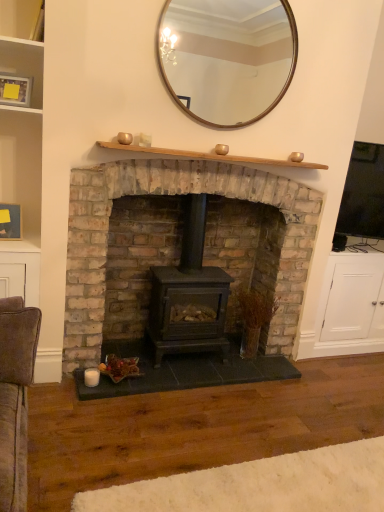
The height and width of the screenshot is (512, 384). Find the location of `matte black wood burning stove at center`. matte black wood burning stove at center is located at coordinates (189, 295).

In order to face wooden picture frame at left, the first picture frame viewed from the back, should I rotate leftwards or rightwards?

Turn left approximately 24.178 degrees to face it.

The height and width of the screenshot is (512, 384). Describe the element at coordinates (181, 242) in the screenshot. I see `matte black wood stove at center` at that location.

Measure the distance between point (25, 82) and camera.

The depth of point (25, 82) is 7.44 feet.

This screenshot has width=384, height=512. Describe the element at coordinates (15, 90) in the screenshot. I see `matte wooden picture frame at upper left, which is counted as the first picture frame, starting from the front` at that location.

Identify the location of wooden shelf at upper center. This screenshot has width=384, height=512. (209, 156).

Is point (250, 158) positioned before point (268, 475)?

No, it is not.

Choose the correct answer: Is wooden shelf at upper center inside white wool rug at lower center or outside it?

wooden shelf at upper center exists outside the volume of white wool rug at lower center.

Can you see wooden shelf at upper center touching white wool rug at lower center?

No, wooden shelf at upper center is not next to white wool rug at lower center.

From a real-world perspective, is matte black wood burning stove at center above or below white wool rug at lower center?

From a real-world perspective, matte black wood burning stove at center is physically above white wool rug at lower center.

Can you tell me how much matte black wood burning stove at center and white wool rug at lower center differ in facing direction?

0.79 degrees separate the facing orientations of matte black wood burning stove at center and white wool rug at lower center.

Is matte black wood burning stove at center inside the boundaries of white wool rug at lower center, or outside?

matte black wood burning stove at center is located beyond the bounds of white wool rug at lower center.

Would you say matte black wood burning stove at center is to the left or to the right of white wool rug at lower center in the picture?

matte black wood burning stove at center is positioned on white wool rug at lower center's left side.

From the image's perspective, which is above, wooden-framed mirror at upper center or white wool rug at lower center?

wooden-framed mirror at upper center.

Which of these two, wooden-framed mirror at upper center or white wool rug at lower center, stands taller?

Standing taller between the two is wooden-framed mirror at upper center.

From a real-world perspective, is wooden-framed mirror at upper center positioned over white wool rug at lower center based on gravity?

Yes.

Looking at this image, is wooden-framed mirror at upper center surrounded by matte black wood burning stove at center?

Definitely not — wooden-framed mirror at upper center is not inside matte black wood burning stove at center.

In the scene shown: Is matte black wood burning stove at center wider than wooden-framed mirror at upper center?

Yes.

Is point (196, 241) closer or farther from the camera than point (230, 109)?

Point (196, 241) is positioned farther from the camera compared to point (230, 109).

Does point (283, 237) lie behind point (267, 493)?

Yes, it is behind point (267, 493).

From the image's perspective, would you say matte black wood stove at center is shown under white wool rug at lower center?

No.

Is matte black wood stove at center positioned with its back to white wool rug at lower center?

matte black wood stove at center does not have its back to white wool rug at lower center.

Between white wool rug at lower center and matte black wood burning stove at center, which one has less height?

Standing shorter between the two is white wool rug at lower center.

Consider the image. Is matte black wood burning stove at center located within white wool rug at lower center?

Definitely not — matte black wood burning stove at center is not inside white wool rug at lower center.

Can you confirm if white wool rug at lower center is positioned to the left of matte black wood burning stove at center?

No.

Measure the distance from white wool rug at lower center to matte black wood burning stove at center.

A distance of 3.68 feet exists between white wool rug at lower center and matte black wood burning stove at center.

Does wooden-framed mirror at upper center turn towards matte black wood stove at center?

No, wooden-framed mirror at upper center is not aimed at matte black wood stove at center.

Considering the points (233, 50) and (214, 233), which point is behind, point (233, 50) or point (214, 233)?

Positioned behind is point (214, 233).

Find the location of a particular element. This screenshot has height=512, width=384. mirror that is behind the matte black wood stove at center is located at coordinates (227, 57).

Where is `mantle on the left of white wool rug at lower center`? This screenshot has width=384, height=512. mantle on the left of white wool rug at lower center is located at coordinates (209, 156).

The height and width of the screenshot is (512, 384). What are the coordinates of `plain that appears in front of the matte black wood burning stove at center` in the screenshot? It's located at (x=260, y=485).

From the image, which object appears to be farther from wooden-framed mirror at upper center, matte black wood stove at center or wooden shelf at upper center?

matte black wood stove at center is positioned further to the anchor wooden-framed mirror at upper center.

Estimate the real-world distances between objects in this image. Which object is further from wooden picture frame at left, the first picture frame viewed from the back, matte black wood stove at center or matte wooden picture frame at upper left, which is the 1th picture frame in top-to-bottom order?

matte black wood stove at center is further to wooden picture frame at left, the first picture frame viewed from the back.

Based on their spatial positions, is wooden picture frame at left, arranged as the 2th picture frame when viewed from the top, or wooden shelf at upper center closer to matte wooden picture frame at upper left, which is counted as the first picture frame, starting from the front?

wooden picture frame at left, arranged as the 2th picture frame when viewed from the top.

Which object lies further to the anchor point wooden picture frame at left, the 2th picture frame in the front-to-back sequence, wooden shelf at upper center or wooden-framed mirror at upper center?

Based on the image, wooden-framed mirror at upper center appears to be further to wooden picture frame at left, the 2th picture frame in the front-to-back sequence.

Consider the image. Considering their positions, is white wool rug at lower center positioned closer to wooden picture frame at left, arranged as the 2th picture frame when viewed from the top, than wooden shelf at upper center?

wooden shelf at upper center.

Based on the photo, based on their spatial positions, is wooden-framed mirror at upper center or wooden picture frame at left, the 1th picture frame ordered from the bottom, further from white wool rug at lower center?

→ wooden-framed mirror at upper center is positioned further to the anchor white wool rug at lower center.

Based on their spatial positions, is matte black wood burning stove at center or wooden picture frame at left, the first picture frame viewed from the back, further from matte black wood stove at center?

wooden picture frame at left, the first picture frame viewed from the back.

Considering their positions, is wooden shelf at upper center positioned closer to wooden-framed mirror at upper center than white wool rug at lower center?

wooden shelf at upper center.

At what (x,y) coordinates should I click in order to perform the action: click on wood burning stove between matte wooden picture frame at upper left, which is the 1th picture frame in top-to-bottom order, and wooden shelf at upper center from left to right. Please return your answer as a coordinate pair (x, y). Image resolution: width=384 pixels, height=512 pixels. Looking at the image, I should click on coord(189,295).

Image resolution: width=384 pixels, height=512 pixels. What are the coordinates of `mantle situated between wooden picture frame at left, the 1th picture frame ordered from the bottom, and wooden-framed mirror at upper center from left to right` in the screenshot? It's located at (209, 156).

In order to click on wood burning stove between wooden shelf at upper center and white wool rug at lower center from top to bottom in this screenshot , I will do `click(189, 295)`.

Locate an element on the screen. The width and height of the screenshot is (384, 512). fireplace situated between wooden picture frame at left, the first picture frame viewed from the back, and wooden shelf at upper center from left to right is located at coordinates (181, 242).